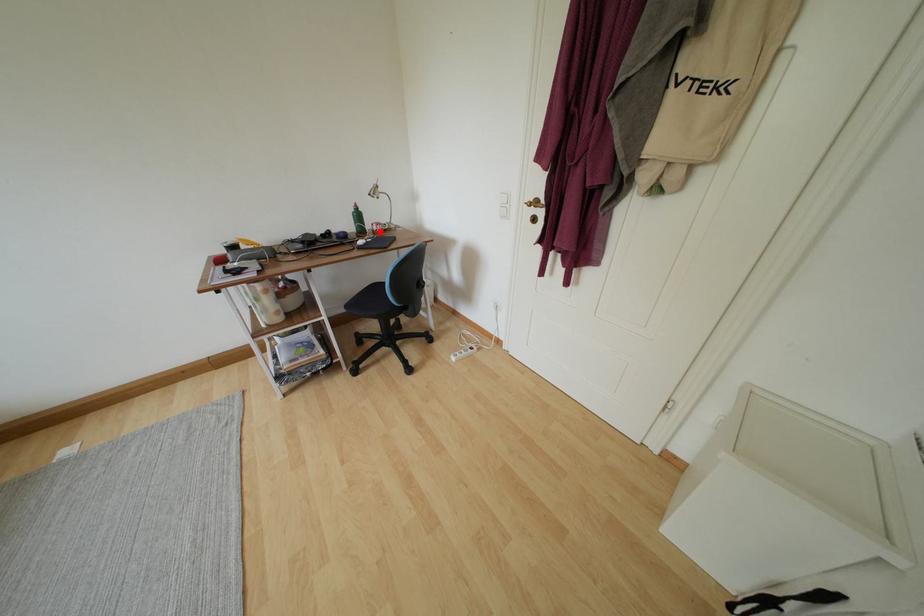
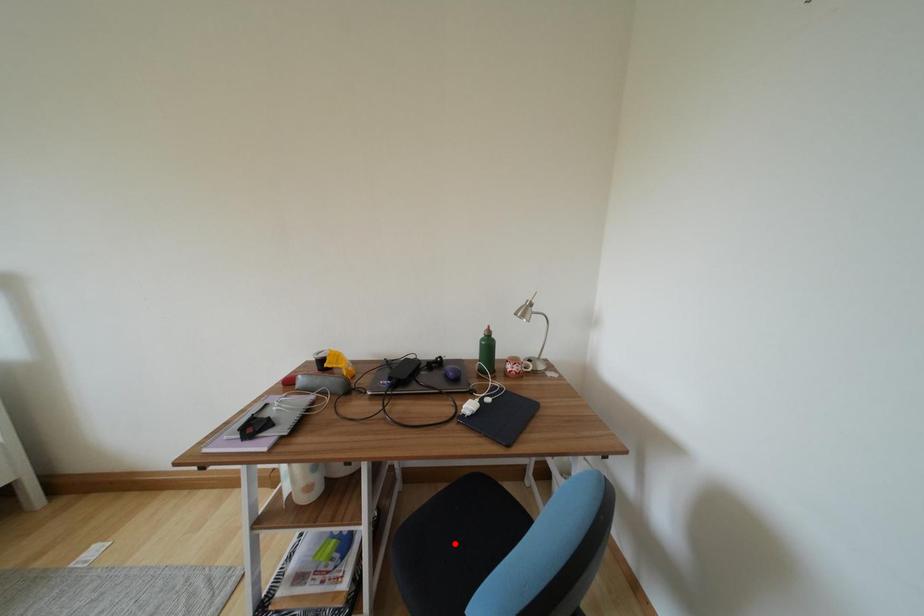
I am providing you with two images of the same scene from different viewpoints. A red point is marked on the first image and another point is marked on the second image. Are the points marked in image1 and image2 representing the same 3D position?

No